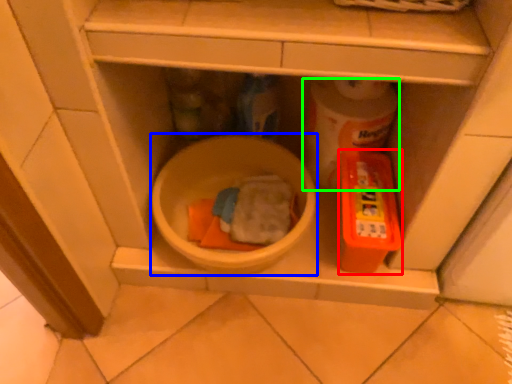
Question: Which is nearer to the toy (highlighted by a red box)? mixing bowl (highlighted by a blue box) or toilet paper (highlighted by a green box).

Choices:
 (A) mixing bowl
 (B) toilet paper

Answer: (B)